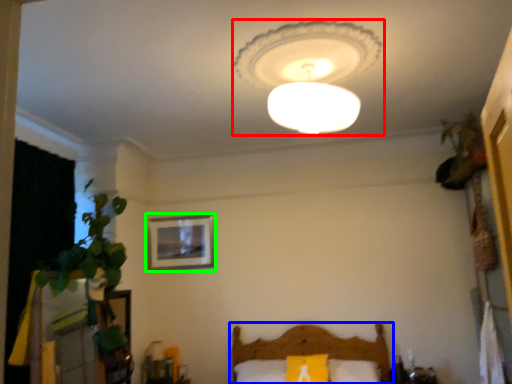
Question: Which is nearer to the lamp (highlighted by a red box)? furniture (highlighted by a blue box) or picture frame (highlighted by a green box).

Choices:
 (A) furniture
 (B) picture frame

Answer: (B)